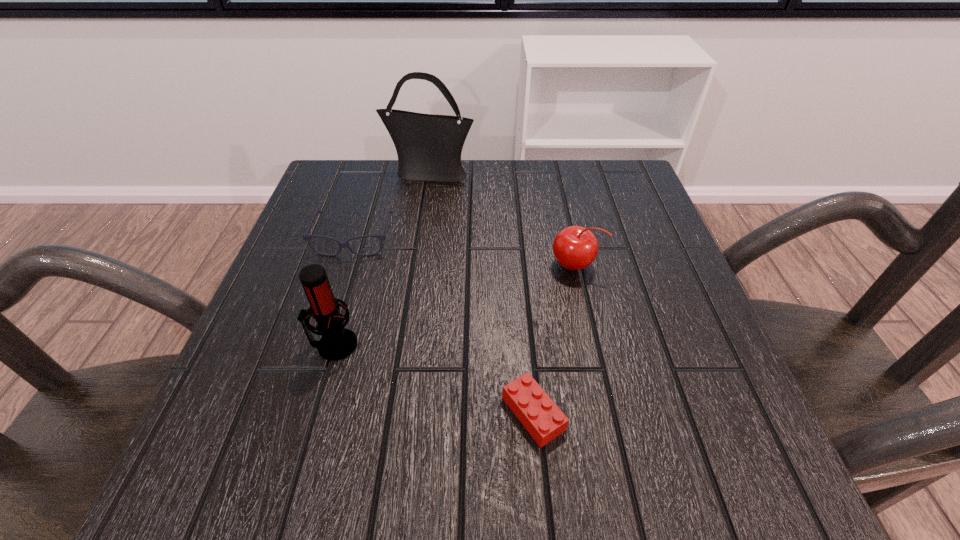
Identify the location of vacant position located on the back of the fourth farthest object. Image resolution: width=960 pixels, height=540 pixels. (368, 226).

Image resolution: width=960 pixels, height=540 pixels. Identify the location of free spot located 0.050m on the right of the cherry. (624, 265).

Locate an element on the screen. blank space located on the front-facing side of the spectacles is located at coordinates (330, 313).

Find the location of a particular element. This screenshot has width=960, height=540. free region located 0.370m on the back of the shortest object is located at coordinates (516, 233).

At what (x,y) coordinates should I click in order to perform the action: click on object present at the far edge. Please return your answer as a coordinate pair (x, y). The height and width of the screenshot is (540, 960). Looking at the image, I should click on (429, 147).

Image resolution: width=960 pixels, height=540 pixels. Identify the location of object positioned at the near edge. (542, 418).

The height and width of the screenshot is (540, 960). I want to click on shoulder bag that is at the left edge, so click(x=429, y=147).

Image resolution: width=960 pixels, height=540 pixels. I want to click on microphone that is at the left edge, so point(337,342).

Find the location of a particular element. This screenshot has width=960, height=540. spectacles at the left edge is located at coordinates (306, 236).

Where is `object present at the right edge`? Image resolution: width=960 pixels, height=540 pixels. object present at the right edge is located at coordinates (575, 248).